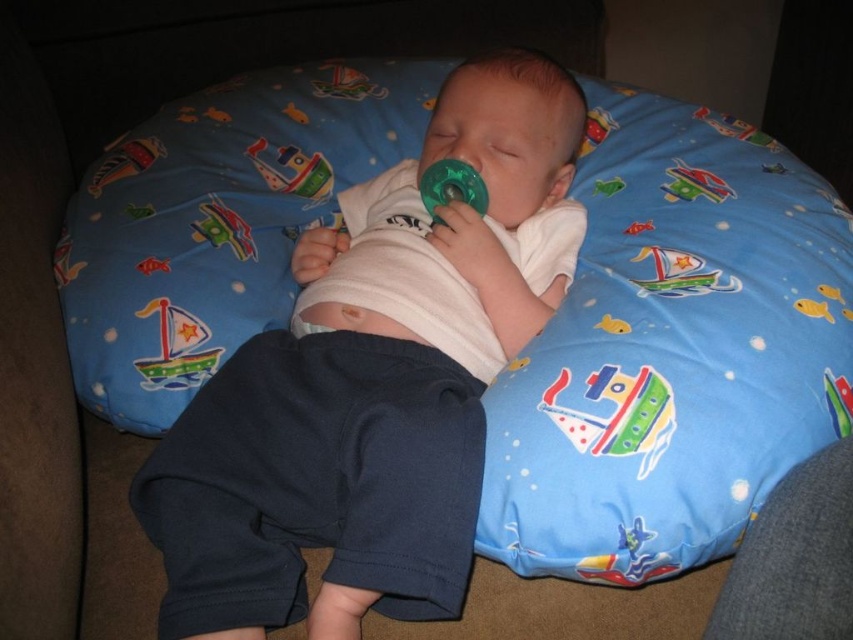
Looking at this image, you are a parent checking on your sleeping baby. You notice the green translucent pacifier at center and the green plastic airplane at upper left. Which object is closer to you?

The green translucent pacifier at center is closer to you because it is in front of the green plastic airplane at upper left.

You are a parent checking on your baby. You notice the white cotton baby at center and the matte plastic boat at upper center. Which object is taller?

The white cotton baby at center is taller than the matte plastic boat at upper center according to the description.